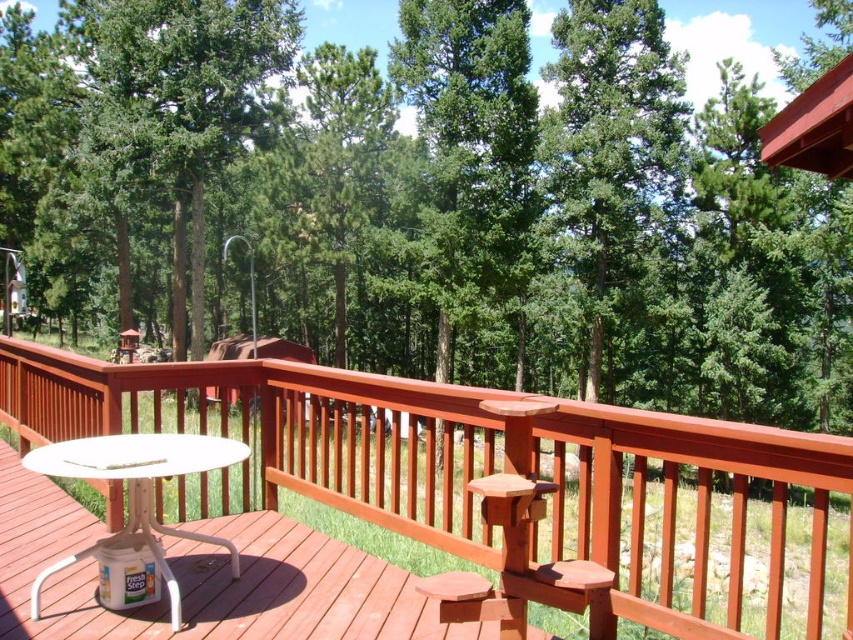
You are a painter standing on the smooth wood balcony at center and want to paint the white plastic table at lower left. Can you see the entire table from your current position?

The smooth wood balcony at center is much taller than the white plastic table at lower left, so yes, you can see the entire table from your current position because you are elevated higher than the table.

You are standing on the wooden deck and want to take a photo of the forest. You notice two points in your viewfinder labeled as point 1 at coordinates point (62, 632) and point 2 at coordinates point (33, 452). Which point will appear larger in your photo?

Point 1 at coordinates point (62, 632) will appear larger in the photo because it is closer to the camera than point 2 at coordinates point (33, 452).

Please describe the location of the point marked at coordinates (506, 470) in the image. What is the nearest object to this point?

The point at coordinates (506, 470) is located on the smooth wood balcony at center, which is the nearest object to this point.